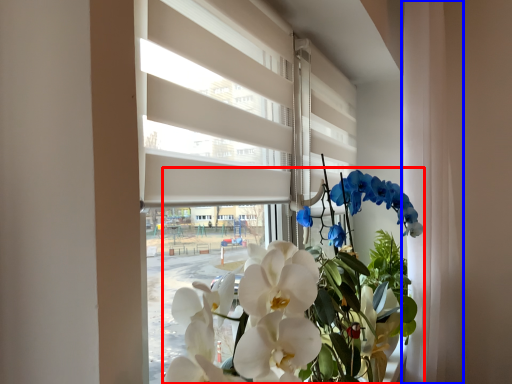
Question: Which object appears closest to the camera in this image, floral arrangement (highlighted by a red box) or curtain (highlighted by a blue box)?

Choices:
 (A) floral arrangement
 (B) curtain

Answer: (A)